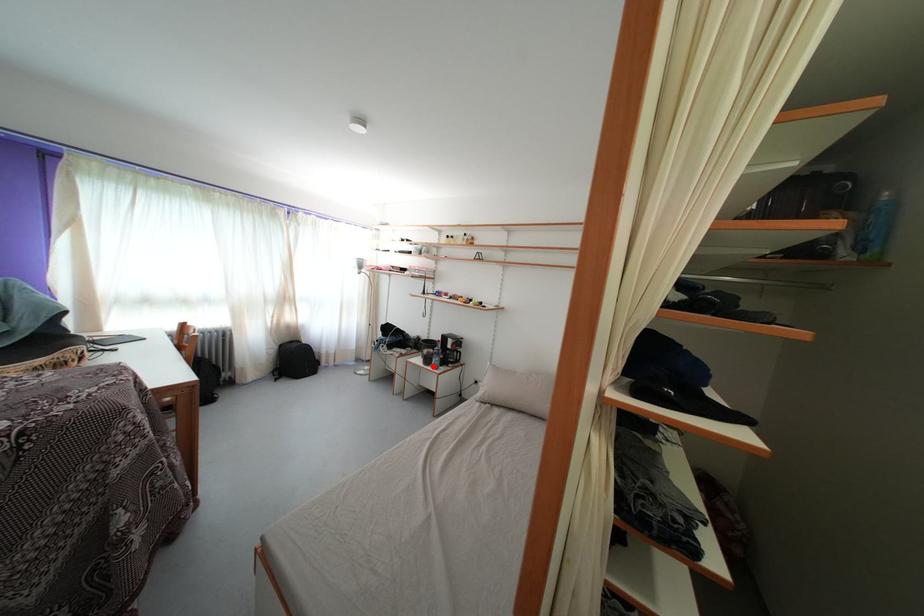
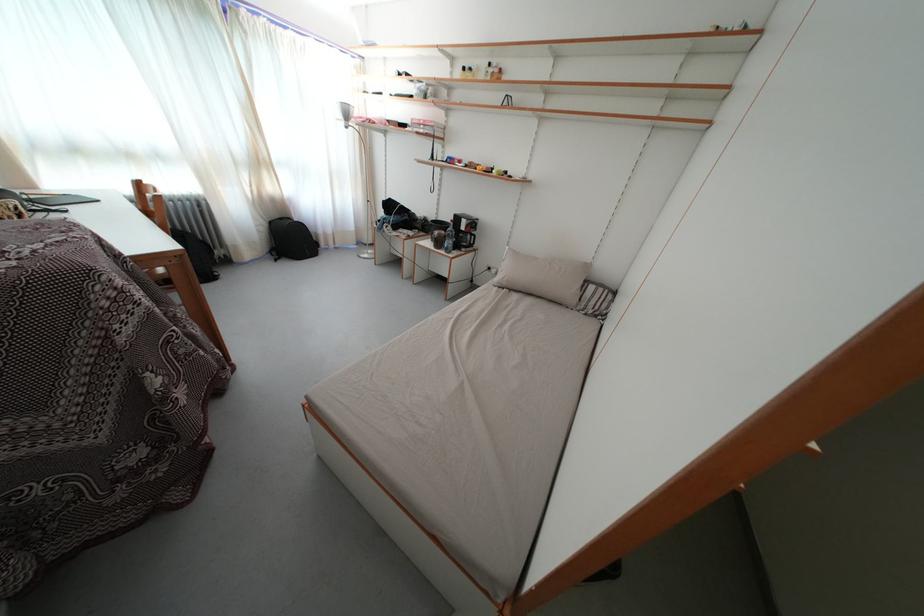
Find the pixel in the second image that matches the highlighted location in the first image.

(444, 249)